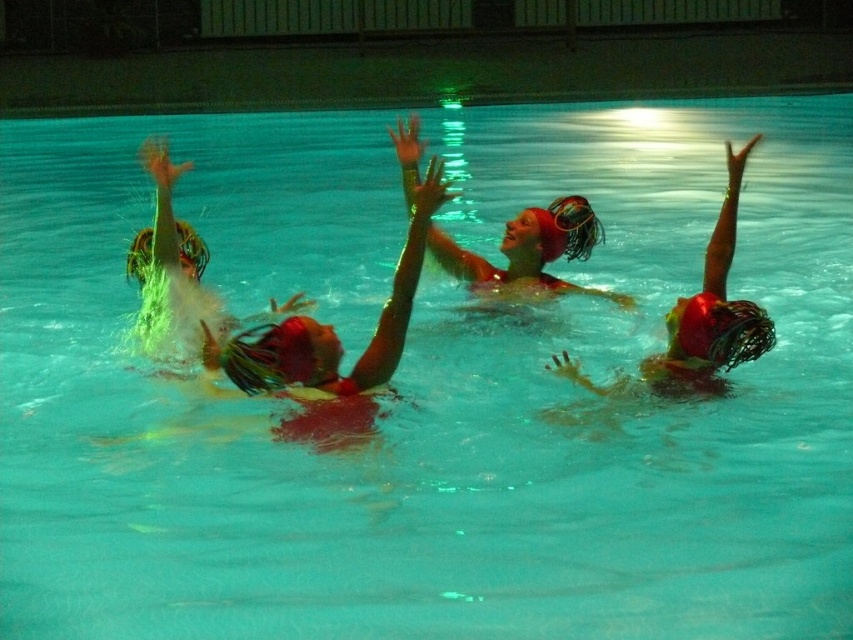
Find the location of a particular element. The height and width of the screenshot is (640, 853). matte red swimsuit at center is located at coordinates point(329,349).

You are a GUI agent. You are given a task and a screenshot of the screen. Output one action in this format:
    pyautogui.click(x=<x>, y=<y>)
    Task: Click on the matte red swimsuit at center
    The height and width of the screenshot is (640, 853).
    Given the screenshot: What is the action you would take?
    [x=329, y=349]

You are a GUI agent. You are given a task and a screenshot of the screen. Output one action in this format:
    pyautogui.click(x=<x>, y=<y>)
    Task: Click on the matte red swimsuit at center
    This screenshot has height=640, width=853.
    Given the screenshot: What is the action you would take?
    pyautogui.click(x=329, y=349)

Is matte red swimsuit at center below matte red swim cap at center?

Yes.

Between matte red swimsuit at center and matte red swim cap at center, which one is positioned higher?

matte red swim cap at center

Identify the location of matte red swimsuit at center. (329, 349).

Which is more to the right, matte red swimsuit at center or shiny red swimsuit at right?

From the viewer's perspective, shiny red swimsuit at right appears more on the right side.

Consider the image. Is matte red swimsuit at center in front of shiny red swimsuit at right?

Yes, it is in front of shiny red swimsuit at right.

Between point (368, 397) and point (724, 336), which one is positioned in front?

Point (724, 336)

Find the location of a particular element. The image size is (853, 640). matte red swimsuit at center is located at coordinates (329, 349).